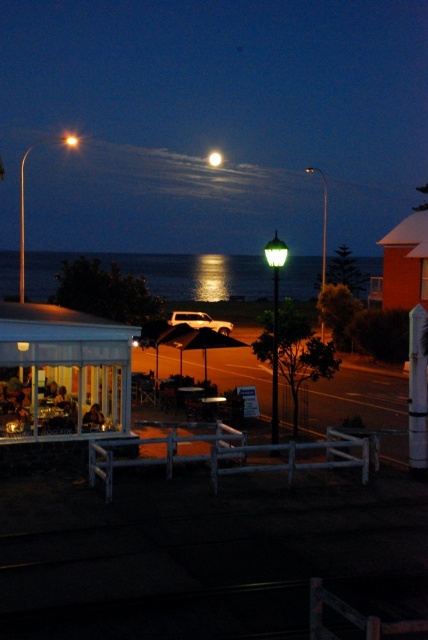
You are standing at the point labeled as point [416,392] in the image, which is the white painted wood post at center right. You want to walk to the covered outdoor seating area with glass walls on the left. Which direction should you move relative to your current position?

You should move to the left towards the covered outdoor seating area with glass walls since it is located to the left of your current position at the white painted wood post at center right.